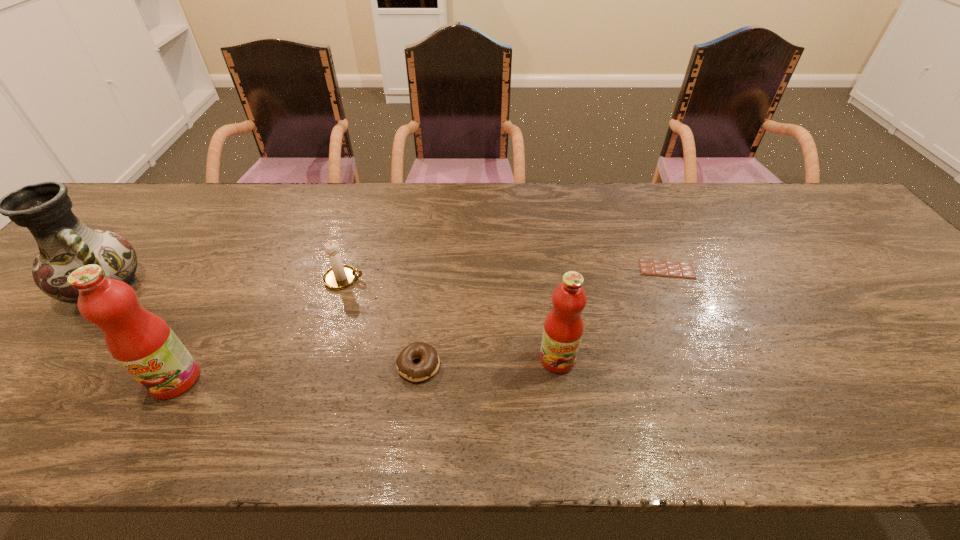
Where is `object that is the second closest to the leftmost object`? The image size is (960, 540). object that is the second closest to the leftmost object is located at coordinates (339, 276).

Select which object appears as the second closest to the chocolate bar. Please provide its 2D coordinates. Your answer should be formatted as a tuple, i.e. [(x, y)], where the tuple contains the x and y coordinates of a point satisfying the conditions above.

[(429, 364)]